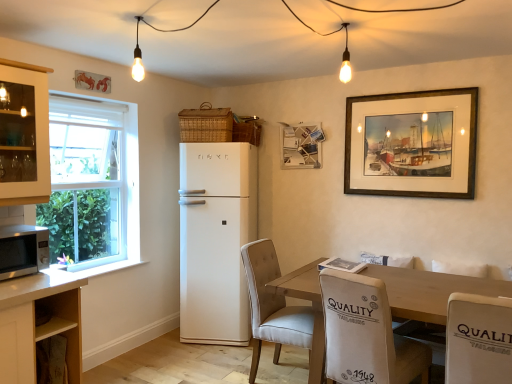
I want to click on vacant area on top of wooden framed painting at upper right, which appears as the first picture frame when viewed from the right (from a real-world perspective), so click(407, 87).